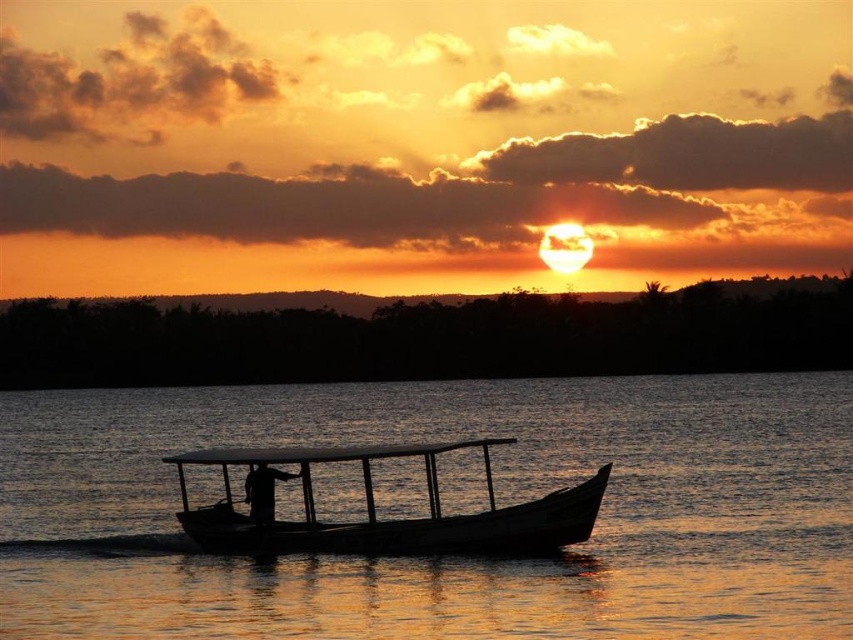
You are a GUI agent. You are given a task and a screenshot of the screen. Output one action in this format:
    pyautogui.click(x=<x>, y=<y>)
    Task: Click on the transparent water at boat center
    The image size is (853, 640).
    Given the screenshot: What is the action you would take?
    pyautogui.click(x=445, y=557)